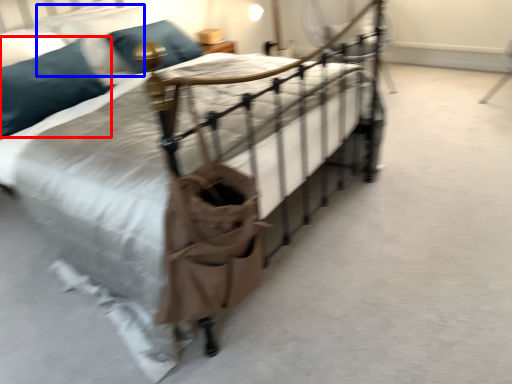
Question: Which point is further to the camera, pillow (highlighted by a red box) or pillow (highlighted by a blue box)?

Choices:
 (A) pillow
 (B) pillow

Answer: (B)